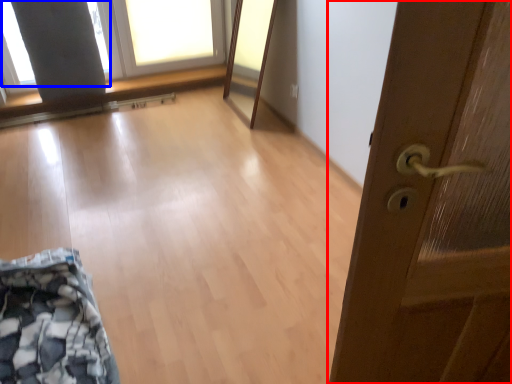
Question: Which point is further to the camera, door (highlighted by a red box) or window screen (highlighted by a blue box)?

Choices:
 (A) door
 (B) window screen

Answer: (B)